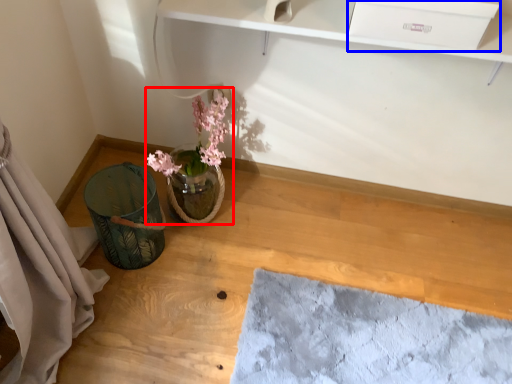
Question: Among these objects, which one is nearest to the camera, floral arrangement (highlighted by a red box) or drawer (highlighted by a blue box)?

Choices:
 (A) floral arrangement
 (B) drawer

Answer: (B)